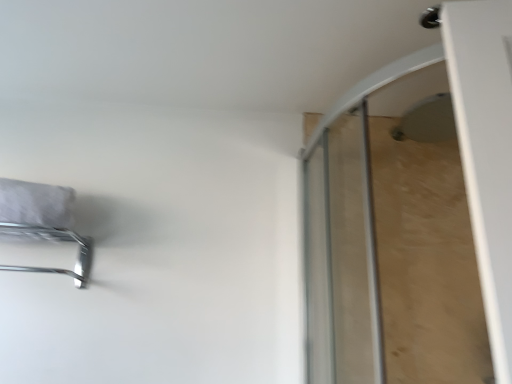
Describe the element at coordinates (42, 223) in the screenshot. This screenshot has width=512, height=384. I see `metal towel rack at left` at that location.

Where is `metal towel rack at left`? metal towel rack at left is located at coordinates (42, 223).

In the scene shown: What is the approximate height of metal towel rack at left?

It is 16.33 centimeters.

I want to click on metal towel rack at left, so click(42, 223).